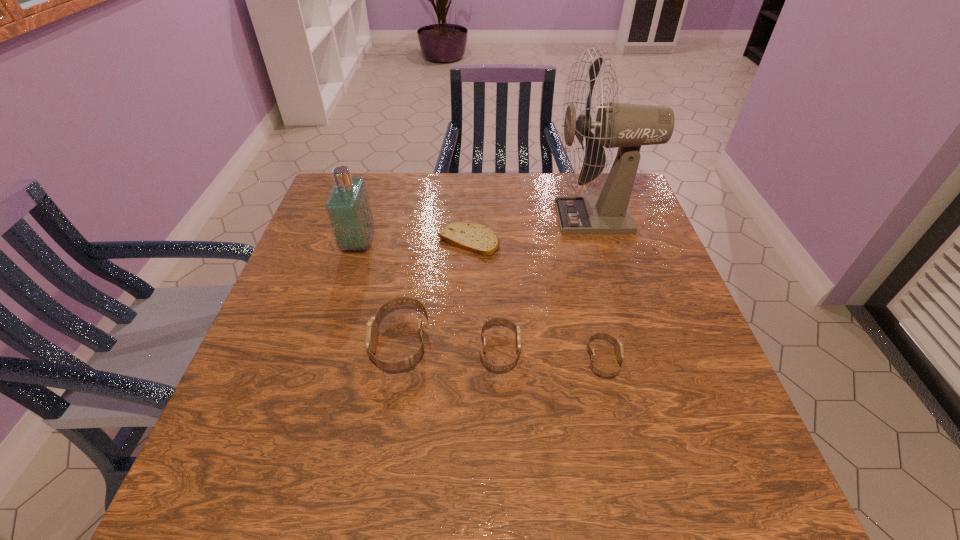
Where is `free space located 0.070m on the face of the third tallest object`? The height and width of the screenshot is (540, 960). free space located 0.070m on the face of the third tallest object is located at coordinates (340, 342).

Where is `vacant space located on the face of the third tallest object`? The width and height of the screenshot is (960, 540). vacant space located on the face of the third tallest object is located at coordinates (345, 342).

Where is `free point located on the face of the third tallest object`? free point located on the face of the third tallest object is located at coordinates (348, 342).

Where is `free location located 0.080m on the face of the second watch from left to right`? Image resolution: width=960 pixels, height=540 pixels. free location located 0.080m on the face of the second watch from left to right is located at coordinates (559, 351).

This screenshot has height=540, width=960. Find the location of `vacant space located 0.180m on the face of the rightmost watch`. vacant space located 0.180m on the face of the rightmost watch is located at coordinates (708, 360).

Identify the location of vacant space situated 0.290m on the front label of the perfume. (481, 243).

Where is `vacant position located 0.310m on the air flow direction of the fan`? This screenshot has width=960, height=540. vacant position located 0.310m on the air flow direction of the fan is located at coordinates (446, 218).

In order to click on vacant space situated 0.220m on the air flow direction of the fan in this screenshot , I will do `click(478, 218)`.

Where is `vacant space situated on the air flow direction of the fan`? The height and width of the screenshot is (540, 960). vacant space situated on the air flow direction of the fan is located at coordinates (498, 218).

Image resolution: width=960 pixels, height=540 pixels. What are the coordinates of `vacant space situated 0.120m on the back of the pita bread` in the screenshot? It's located at (470, 202).